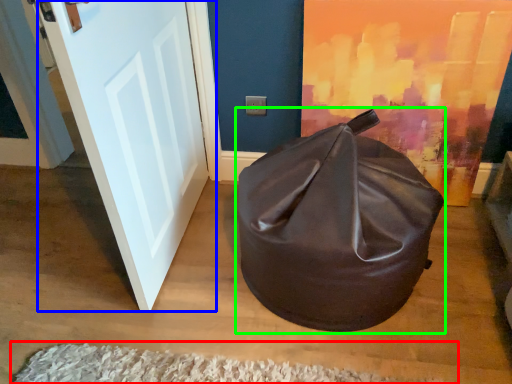
Question: Based on their relative distances, which object is nearer to doormat (highlighted by a red box)? Choose from door (highlighted by a blue box) and bean bag chair (highlighted by a green box).

Choices:
 (A) door
 (B) bean bag chair

Answer: (B)